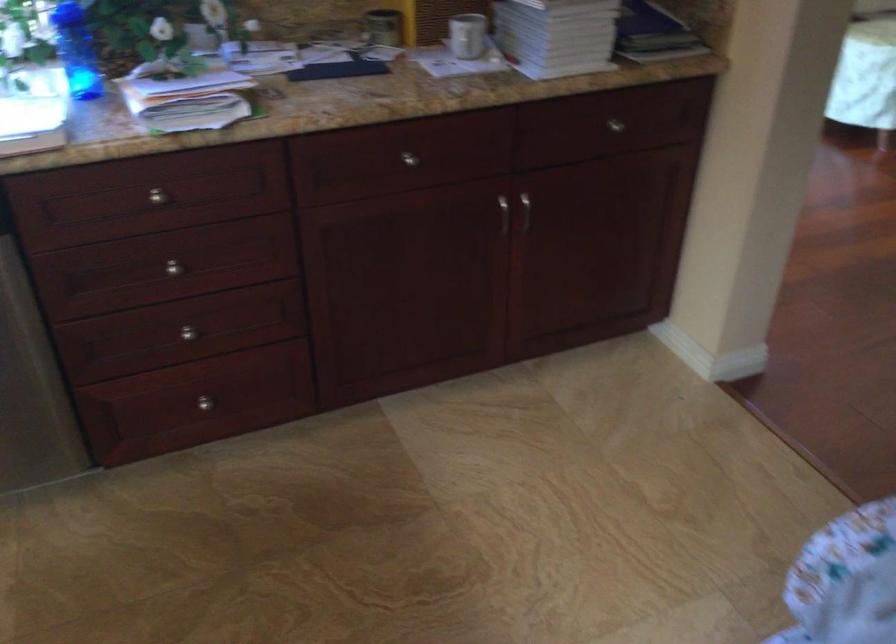
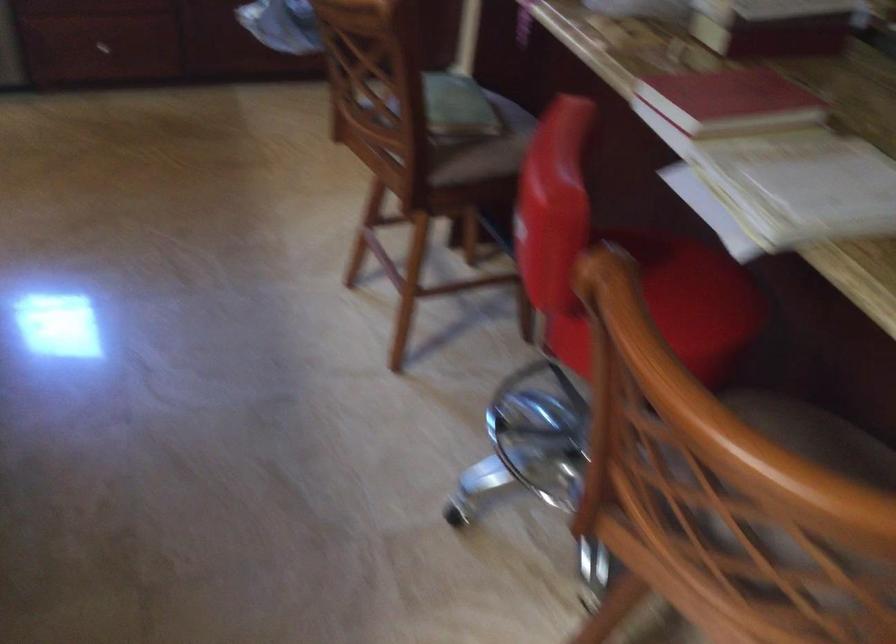
Where in the second image is the point corresponding to [211,429] from the first image?

(98, 52)